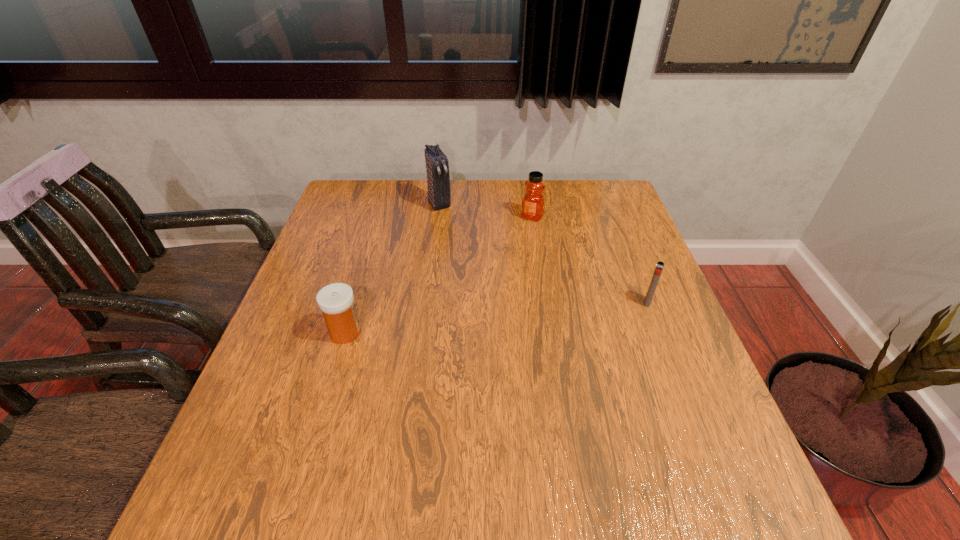
You are a GUI agent. You are given a task and a screenshot of the screen. Output one action in this format:
    pyautogui.click(x=<x>, y=<y>)
    Task: Click on the free space in the image that satisfies the following two spatial constraints: 1. on the back side of the rightmost object; 2. on the right side of the nearest object
    The image size is (960, 540).
    Given the screenshot: What is the action you would take?
    pyautogui.click(x=354, y=302)